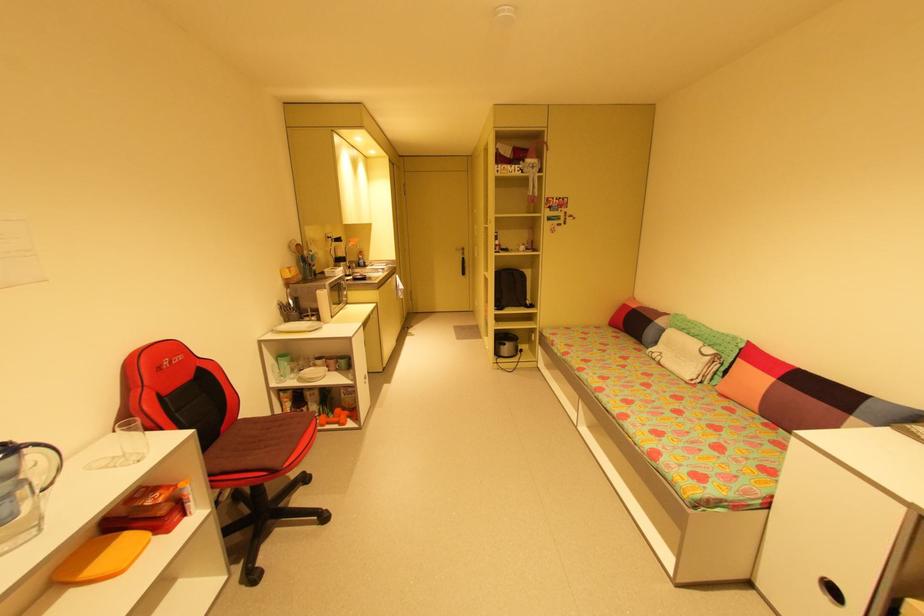
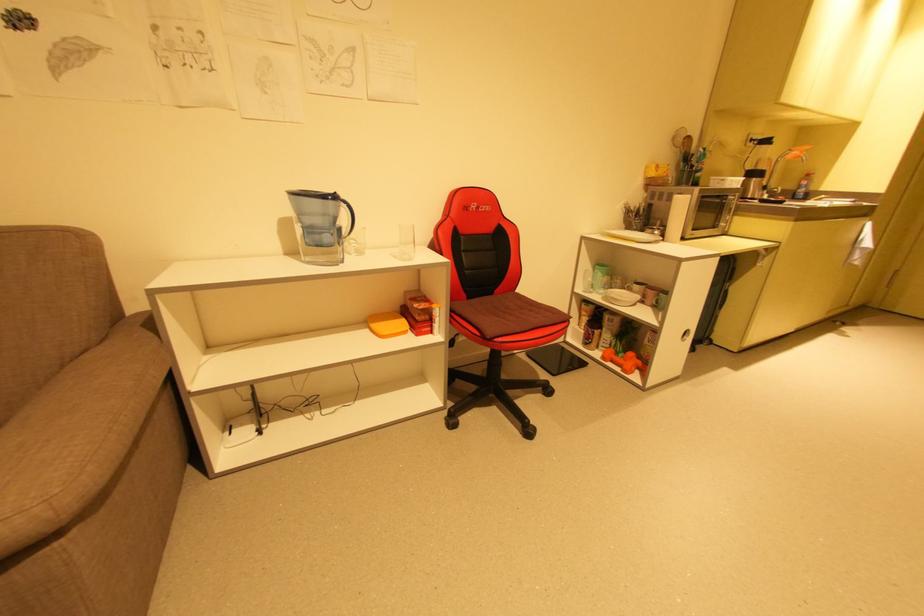
In the second image, find the point that corresponds to [353,419] in the first image.

(641, 371)